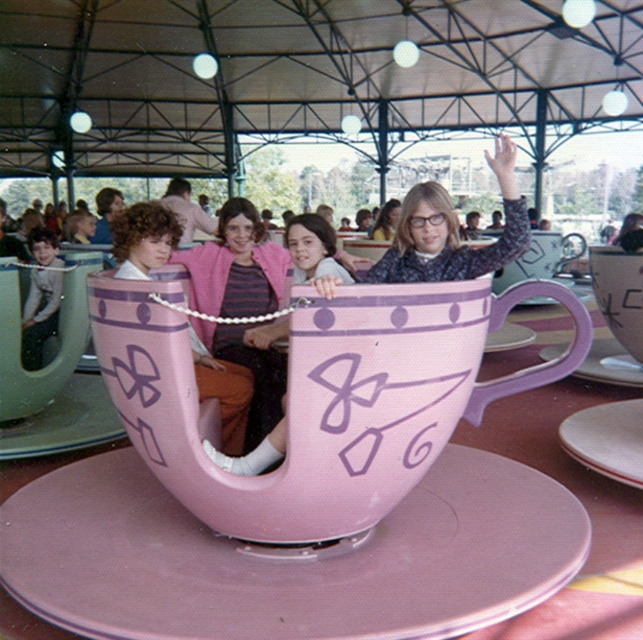
Question: Which of these objects is positioned closest to the white glossy saucer at lower right?

Choices:
 (A) white matte saucer at center
 (B) matte purple cup at center
 (C) pink matte saucer at center

Answer: (C)

Question: Does pink matte saucer at center come behind matte white teacup at upper right?

Choices:
 (A) yes
 (B) no

Answer: (B)

Question: Which point appears closest to the camera in this image?

Choices:
 (A) (161, 636)
 (B) (231, 332)

Answer: (A)

Question: Can you confirm if matte purple cup at center is positioned to the left of matte white teacup at upper right?

Choices:
 (A) no
 (B) yes

Answer: (B)

Question: Among these points, which one is nearest to the camera?

Choices:
 (A) (626, 253)
 (B) (611, 410)
 (C) (635, 385)
 (D) (138, 529)

Answer: (D)

Question: Can you confirm if matte pink sweater at center is smaller than white glossy saucer at lower right?

Choices:
 (A) yes
 (B) no

Answer: (B)